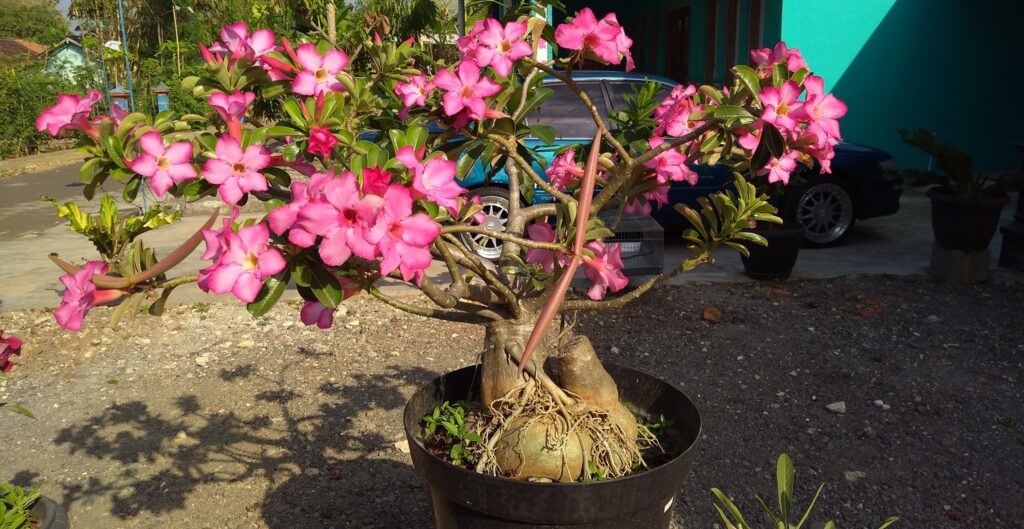
This screenshot has height=529, width=1024. What are the coordinates of `window` in the screenshot? It's located at (561, 107).